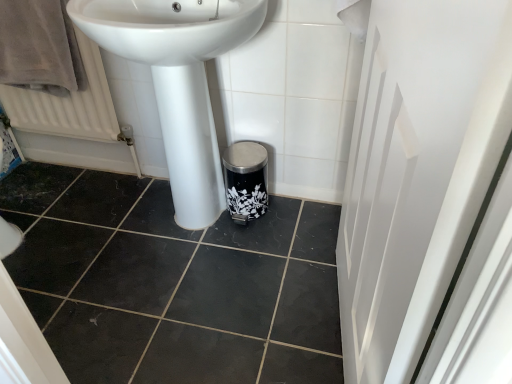
What do you see at coordinates (178, 80) in the screenshot?
I see `white glossy sink at center` at bounding box center [178, 80].

What is the approximate width of white glossy sink at center?

17.93 inches.

This screenshot has width=512, height=384. Describe the element at coordinates (39, 47) in the screenshot. I see `brown velvety bath towel at upper left` at that location.

This screenshot has width=512, height=384. What are the coordinates of `white textured radiator at left` in the screenshot? It's located at (67, 104).

Identify the location of white glossy sink at center. (178, 80).

In terms of size, does white glossy screen door at right appear bigger or smaller than white textured radiator at left?

Clearly, white glossy screen door at right is larger in size than white textured radiator at left.

Does white glossy screen door at right appear on the left side of white textured radiator at left?

No, white glossy screen door at right is not to the left of white textured radiator at left.

Can you tell me how much white glossy screen door at right and white textured radiator at left differ in facing direction?

82.8 degrees separate the facing orientations of white glossy screen door at right and white textured radiator at left.

Locate an element on the screen. This screenshot has width=512, height=384. screen door that is in front of the white textured radiator at left is located at coordinates (417, 171).

Is the surface of white glossy screen door at right in direct contact with brown velvety bath towel at upper left?

white glossy screen door at right and brown velvety bath towel at upper left are clearly separated.

The image size is (512, 384). In order to click on bath towel above the white glossy screen door at right (from the image's perspective) in this screenshot , I will do `click(39, 47)`.

Which is more to the right, white glossy screen door at right or brown velvety bath towel at upper left?

From the viewer's perspective, white glossy screen door at right appears more on the right side.

Is point (17, 43) less distant than point (390, 137)?

No, (17, 43) is behind (390, 137).

Is brown velvety bath towel at upper left to the left of white glossy screen door at right from the viewer's perspective?

Indeed, brown velvety bath towel at upper left is positioned on the left side of white glossy screen door at right.

Is brown velvety bath towel at upper left further to the viewer compared to white glossy screen door at right?

Yes, it is behind white glossy screen door at right.

How far apart are brown velvety bath towel at upper left and white glossy screen door at right?

The distance of brown velvety bath towel at upper left from white glossy screen door at right is 4.01 feet.

From a real-world perspective, is white textured radiator at left physically located above or below white glossy screen door at right?

white textured radiator at left is situated lower than white glossy screen door at right in the real world.

Can you tell me how much white textured radiator at left and white glossy screen door at right differ in facing direction?

The facing directions of white textured radiator at left and white glossy screen door at right are 82.8 degrees apart.

Measure the distance between white textured radiator at left and white glossy screen door at right.

4.13 feet.

Where is `radiator below the white glossy screen door at right (from a real-world perspective)`? The width and height of the screenshot is (512, 384). radiator below the white glossy screen door at right (from a real-world perspective) is located at coordinates (67, 104).

How different are the orientations of white glossy sink at center and white textured radiator at left in degrees?

The angular difference between white glossy sink at center and white textured radiator at left is 0.338 degrees.

Choose the correct answer: Is white glossy sink at center inside white textured radiator at left or outside it?

white glossy sink at center is outside white textured radiator at left.

Are white glossy sink at center and white textured radiator at left far apart?

That's not correct — white glossy sink at center is a little close to white textured radiator at left.

Is white glossy sink at center bigger or smaller than white textured radiator at left?

white glossy sink at center is bigger than white textured radiator at left.

From the image's perspective, between white glossy screen door at right and white glossy sink at center, which one is located above?

white glossy sink at center.

Would you say white glossy screen door at right is a long distance from white glossy sink at center?

No.

Can you confirm if white glossy screen door at right is shorter than white glossy sink at center?

No.

How many degrees apart are the facing directions of white glossy screen door at right and white glossy sink at center?

They differ by 82.4 degrees in their facing directions.

Is the surface of white textured radiator at left in direct contact with white glossy sink at center?

white textured radiator at left and white glossy sink at center are not in contact.

Is white textured radiator at left closer to camera compared to white glossy sink at center?

No, it is not.

Between white textured radiator at left and white glossy sink at center, which one appears on the right side from the viewer's perspective?

white glossy sink at center is more to the right.

Considering the points (95, 91) and (160, 119), which point is behind, point (95, 91) or point (160, 119)?

The point (160, 119) is farther from the camera.

The image size is (512, 384). Identify the location of radiator that is behind the white glossy screen door at right. (67, 104).

I want to click on screen door located underneath the brown velvety bath towel at upper left (from a real-world perspective), so click(x=417, y=171).

When comparing their distances from white glossy screen door at right, does brown velvety bath towel at upper left or white textured radiator at left seem closer?

Among the two, brown velvety bath towel at upper left is located nearer to white glossy screen door at right.

When comparing their distances from white glossy screen door at right, does brown velvety bath towel at upper left or white glossy sink at center seem closer?

Based on the image, white glossy sink at center appears to be nearer to white glossy screen door at right.

Estimate the real-world distances between objects in this image. Which object is further from white glossy screen door at right, white textured radiator at left or white glossy sink at center?

white textured radiator at left lies further to white glossy screen door at right than the other object.

From the image, which object appears to be farther from white glossy screen door at right, white textured radiator at left or brown velvety bath towel at upper left?

The object further to white glossy screen door at right is white textured radiator at left.

From the image, which object appears to be farther from white glossy sink at center, white glossy screen door at right or brown velvety bath towel at upper left?

white glossy screen door at right lies further to white glossy sink at center than the other object.

Based on their spatial positions, is white glossy sink at center or white textured radiator at left further from brown velvety bath towel at upper left?

white glossy sink at center is positioned further to the anchor brown velvety bath towel at upper left.

From the image, which object appears to be nearer to white glossy sink at center, white glossy screen door at right or white textured radiator at left?

white textured radiator at left is positioned closer to the anchor white glossy sink at center.

Which object lies further to the anchor point brown velvety bath towel at upper left, white glossy sink at center or white glossy screen door at right?

white glossy screen door at right is positioned further to the anchor brown velvety bath towel at upper left.

You are a GUI agent. You are given a task and a screenshot of the screen. Output one action in this format:
    pyautogui.click(x=<x>, y=<y>)
    Task: Click on the sink positioned between white glossy screen door at right and white textured radiator at left from near to far
    The height and width of the screenshot is (384, 512).
    Given the screenshot: What is the action you would take?
    pyautogui.click(x=178, y=80)

Find the location of `radiator located between brown velvety bath towel at upper left and white glossy screen door at right in the left-right direction`. radiator located between brown velvety bath towel at upper left and white glossy screen door at right in the left-right direction is located at coordinates (67, 104).

Where is `sink located between brown velvety bath towel at upper left and white glossy screen door at right in the left-right direction`? sink located between brown velvety bath towel at upper left and white glossy screen door at right in the left-right direction is located at coordinates (178, 80).

The width and height of the screenshot is (512, 384). I want to click on radiator located between brown velvety bath towel at upper left and white glossy sink at center in the left-right direction, so [x=67, y=104].